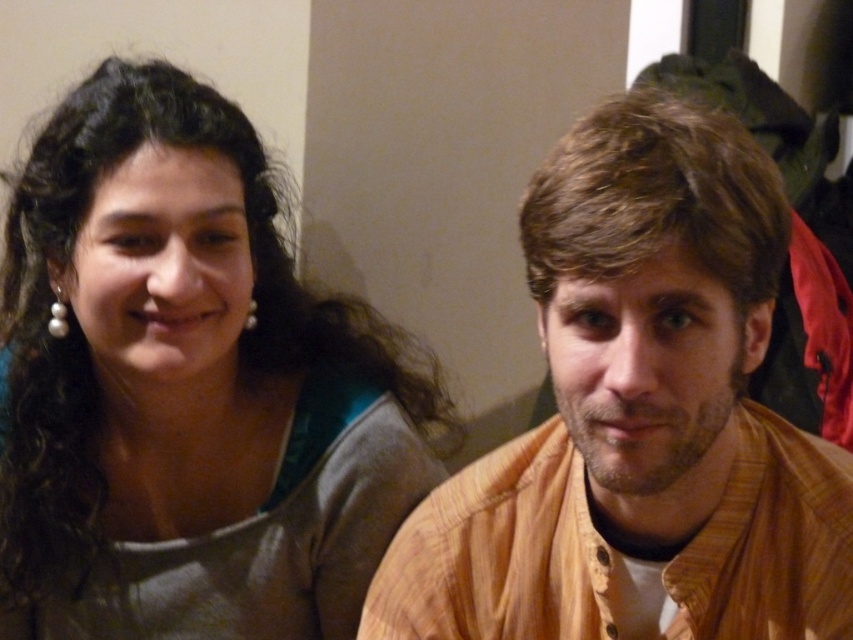
Question: Among these points, which one is nearest to the camera?

Choices:
 (A) (57, 324)
 (B) (762, 230)

Answer: (B)

Question: Which object is the closest to the brown striped shirt at right?

Choices:
 (A) pearl earring at left
 (B) matte green dress at left

Answer: (B)

Question: Is matte green dress at left bigger than pearl earring at left?

Choices:
 (A) yes
 (B) no

Answer: (A)

Question: Which point appears closest to the camera in this image?

Choices:
 (A) (705, 342)
 (B) (263, 172)

Answer: (A)

Question: Does brown striped shirt at right come behind pearlearring at upper left?

Choices:
 (A) no
 (B) yes

Answer: (A)

Question: Is matte green dress at left to the left of brown striped shirt at right from the viewer's perspective?

Choices:
 (A) no
 (B) yes

Answer: (B)